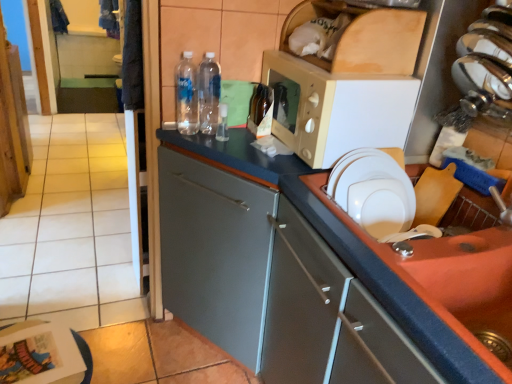
Question: Based on their sizes in the image, would you say white matte paper plate at right is bigger or smaller than matte gray cabinet at center?

Choices:
 (A) big
 (B) small

Answer: (B)

Question: In the image, is white matte paper plate at right on the left side or the right side of matte gray cabinet at center?

Choices:
 (A) left
 (B) right

Answer: (B)

Question: Considering the real-world distances, which object is closest to the matte gray cabinet at center?

Choices:
 (A) clear plastic bottle at center, the first bottle in the left-to-right sequence
 (B) translucent glass bottle at center, the third bottle viewed from the left
 (C) white tile at upper left
 (D) transparent plastic bottles at center, placed as the 2th bottle when sorted from right to left
 (E) orange matte sink at lower right

Answer: (E)

Question: Based on their relative distances, which object is nearer to the translucent glass bottle at center, the third bottle viewed from the left?

Choices:
 (A) transparent plastic bottles at center, placed as the 2th bottle when sorted from right to left
 (B) matte gray cabinet at center
 (C) white matte paper plate at right
 (D) beige plastic microwave at upper center
 (E) clear plastic bottle at center, placed as the third bottle when sorted from right to left

Answer: (A)